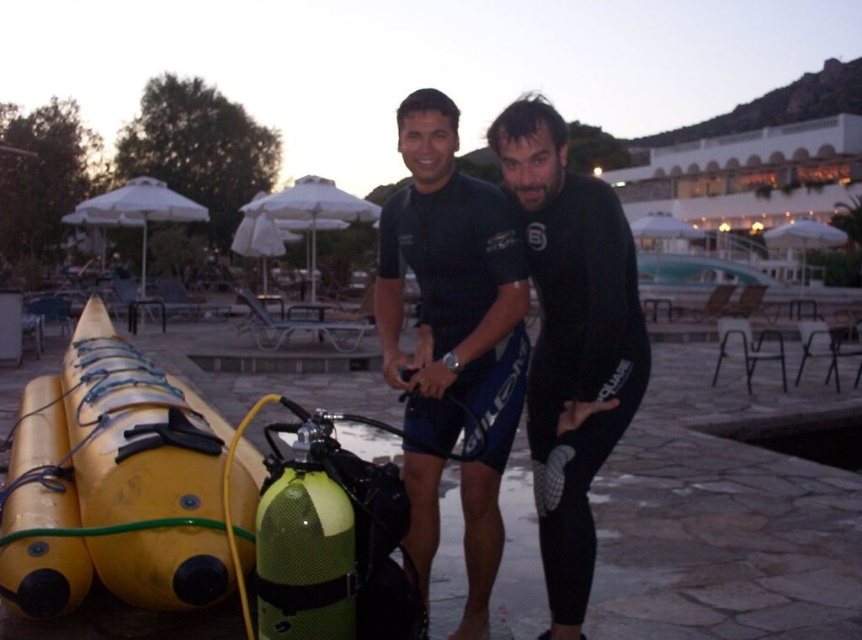
Who is positioned more to the right, yellow matte kayak at lower left or black neoprene wetsuit at center?

Positioned to the right is black neoprene wetsuit at center.

Who is positioned more to the left, yellow matte kayak at lower left or black neoprene wetsuit at center?

From the viewer's perspective, yellow matte kayak at lower left appears more on the left side.

Find the location of `yellow matte kayak at lower left`. yellow matte kayak at lower left is located at coordinates (145, 472).

Where is `yellow matte kayak at lower left`? yellow matte kayak at lower left is located at coordinates (145, 472).

Between black matte wetsuit at center and yellow matte kayak at lower left, which one appears on the left side from the viewer's perspective?

From the viewer's perspective, yellow matte kayak at lower left appears more on the left side.

What are the coordinates of `black matte wetsuit at center` in the screenshot? It's located at (558, 332).

Which is in front, point (451, 108) or point (186, 440)?

Positioned in front is point (451, 108).

The image size is (862, 640). What are the coordinates of `black matte wetsuit at center` in the screenshot? It's located at [x=558, y=332].

Measure the distance between black matte wetsuit at center and black neoprene wetsuit at center.

They are 9.22 centimeters apart.

Which is more to the left, black matte wetsuit at center or black neoprene wetsuit at center?

black matte wetsuit at center is more to the left.

Where is `black matte wetsuit at center`? black matte wetsuit at center is located at coordinates (558, 332).